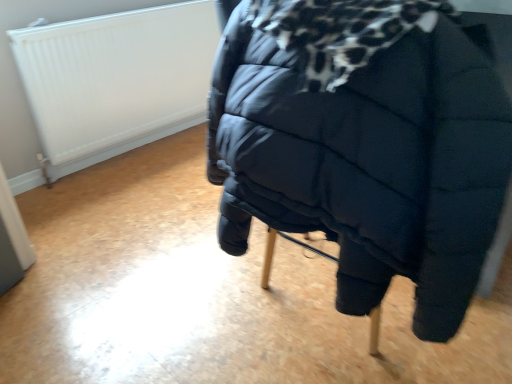
Where is `vacant region below white textured radiator at upper left (from a real-world perspective)`? The height and width of the screenshot is (384, 512). vacant region below white textured radiator at upper left (from a real-world perspective) is located at coordinates (134, 152).